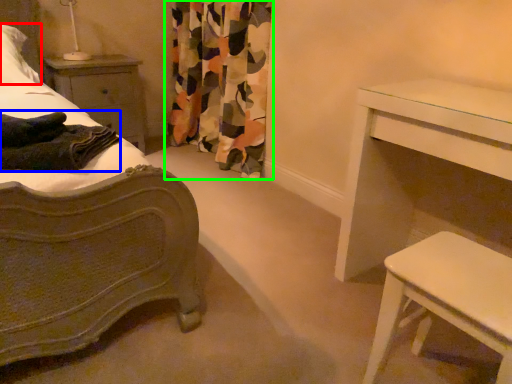
Question: Based on their relative distances, which object is farther from pillow (highlighted by a red box)? Choose from blanket (highlighted by a blue box) and curtain (highlighted by a green box).

Choices:
 (A) blanket
 (B) curtain

Answer: (B)